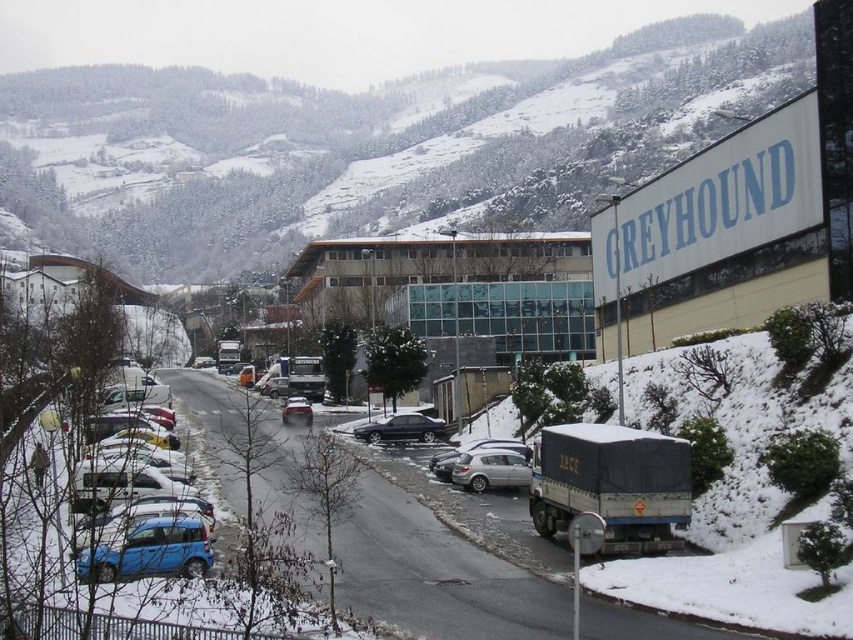
Question: Which point is farther from the camera taking this photo?

Choices:
 (A) (302, 422)
 (B) (461, 476)
 (C) (204, 529)
 (D) (74, 477)

Answer: (A)

Question: Can you confirm if matte blue hatchback at lower left is positioned to the right of silver metallic car at center?

Choices:
 (A) yes
 (B) no

Answer: (B)

Question: Which object is closer to the camera taking this photo?

Choices:
 (A) blue matte car at left
 (B) matte blue hatchback at lower left
 (C) metallic silver sedan at center
 (D) silver metallic car at center

Answer: (B)

Question: Can you confirm if silver metallic car at center is bigger than metallic silver sedan at center?

Choices:
 (A) no
 (B) yes

Answer: (A)

Question: Can you confirm if satin black sedan at center is positioned above metallic silver sedan at center?

Choices:
 (A) yes
 (B) no

Answer: (B)

Question: Estimate the real-world distances between objects in this image. Which object is closer to the satin black sedan at center?

Choices:
 (A) matte blue hatchback at lower left
 (B) metallic silver sedan at center
 (C) blue matte car at left
 (D) silver metallic car at center

Answer: (B)